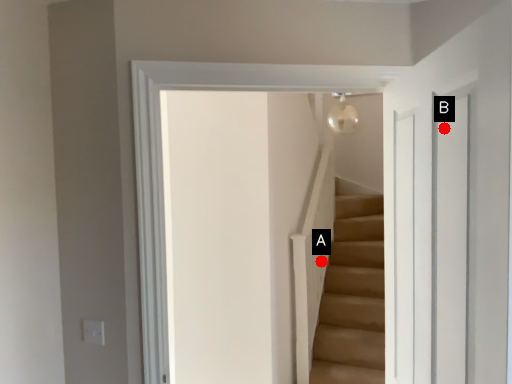
Question: Two points are circled on the image, labeled by A and B beside each circle. Which point is farther to the camera?

Choices:
 (A) A is further
 (B) B is further

Answer: (A)